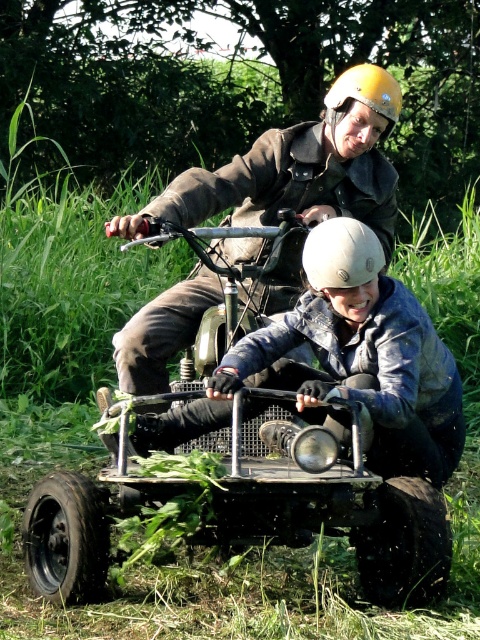
Does white matte helmet at center have a smaller size compared to yellow matte helmet at upper center?

No, white matte helmet at center is not smaller than yellow matte helmet at upper center.

Can you confirm if white matte helmet at center is positioned above yellow matte helmet at upper center?

No.

I want to click on white matte helmet at center, so click(345, 266).

Where is `white matte helmet at center`? white matte helmet at center is located at coordinates (345, 266).

Does matte black helmet at center have a lesser width compared to white matte helmet at center?

Incorrect, matte black helmet at center's width is not less than white matte helmet at center's.

Consider the image. Does matte black helmet at center appear over white matte helmet at center?

No.

Who is more forward, (x=431, y=349) or (x=368, y=269)?

Positioned in front is point (x=368, y=269).

The width and height of the screenshot is (480, 640). In order to click on matte black helmet at center in this screenshot , I will do `click(344, 368)`.

Is matte black jacket at center shorter than yellow matte helmet at upper center?

No, matte black jacket at center is not shorter than yellow matte helmet at upper center.

Is point (324, 109) closer to viewer compared to point (345, 81)?

That is False.

This screenshot has height=640, width=480. In order to click on matte black jacket at center in this screenshot , I will do `click(299, 168)`.